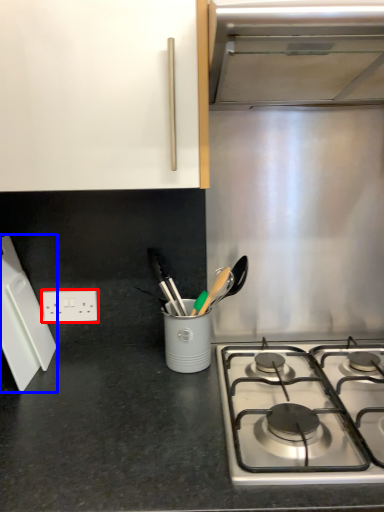
Question: Which object is closer to the camera taking this photo, electric outlet (highlighted by a red box) or kitchen appliance (highlighted by a blue box)?

Choices:
 (A) electric outlet
 (B) kitchen appliance

Answer: (B)